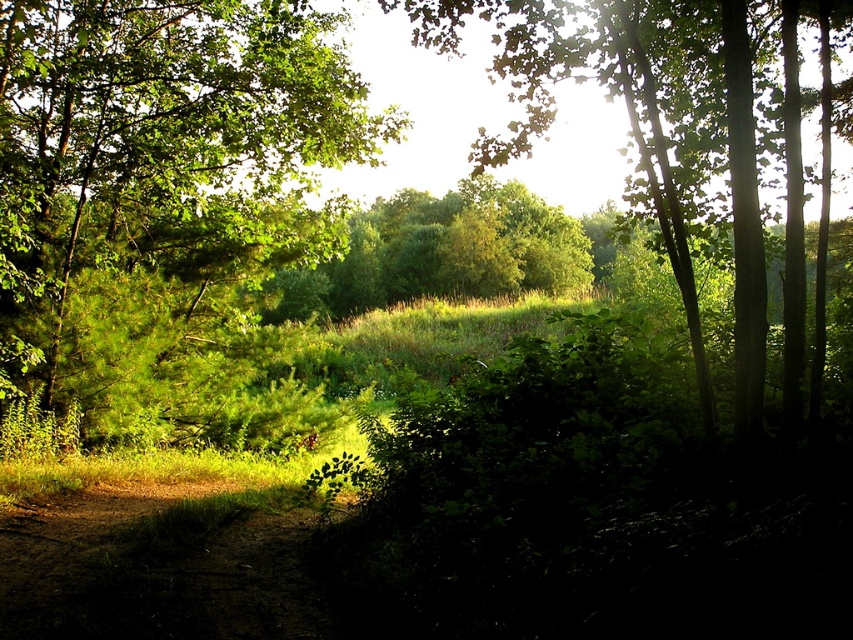
This screenshot has height=640, width=853. What do you see at coordinates (167, 209) in the screenshot?
I see `green leafy tree at left` at bounding box center [167, 209].

Is green leafy tree at left bigger than brown dirt trail at lower left?

Indeed, green leafy tree at left has a larger size compared to brown dirt trail at lower left.

Is point (193, 289) in front of point (172, 496)?

No.

Where is `green leafy tree at left`? The image size is (853, 640). green leafy tree at left is located at coordinates (167, 209).

Does green leafy tree at center have a greater height compared to brown dirt trail at lower left?

Correct, green leafy tree at center is much taller as brown dirt trail at lower left.

In the scene shown: Can you confirm if green leafy tree at center is positioned below brown dirt trail at lower left?

No, green leafy tree at center is not below brown dirt trail at lower left.

Which is behind, point (749, 109) or point (213, 589)?

Point (213, 589)

You are a GUI agent. You are given a task and a screenshot of the screen. Output one action in this format:
    pyautogui.click(x=<x>, y=<y>)
    Task: Click on the green leafy tree at center
    The width and height of the screenshot is (853, 640).
    Given the screenshot: What is the action you would take?
    pyautogui.click(x=672, y=140)

Who is lower down, green leafy tree at left or green leafy tree at center?

green leafy tree at left is below.

Does point (224, 371) come in front of point (746, 189)?

No, (224, 371) is further to viewer.

The height and width of the screenshot is (640, 853). What do you see at coordinates (167, 209) in the screenshot?
I see `green leafy tree at left` at bounding box center [167, 209].

Where is `green leafy tree at left`? The width and height of the screenshot is (853, 640). green leafy tree at left is located at coordinates (167, 209).